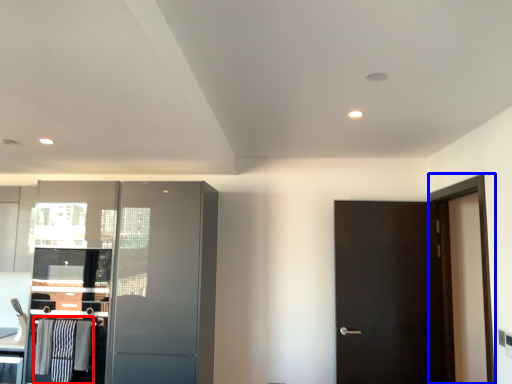
Question: Which of the following is the farthest to the observer, laundry (highlighted by a red box) or screen door (highlighted by a blue box)?

Choices:
 (A) laundry
 (B) screen door

Answer: (A)